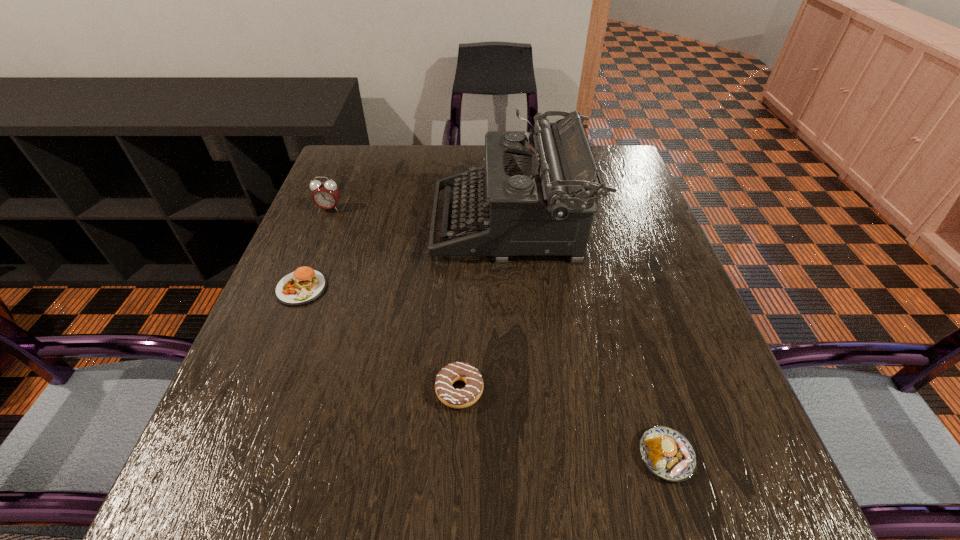
You are a GUI agent. You are given a task and a screenshot of the screen. Output one action in this format:
    pyautogui.click(x=<x>, y=<y>)
    Task: Click on the typewriter
    This screenshot has height=540, width=960.
    Given the screenshot: What is the action you would take?
    (x=539, y=193)

Identify the location of the second tallest object. Image resolution: width=960 pixels, height=540 pixels. (326, 194).

Find the location of a particular element. This screenshot has height=540, width=960. patty is located at coordinates (304, 285).

Identify the location of the second nearest object. The width and height of the screenshot is (960, 540). (455, 398).

Locate an element on the screen. the nearest object is located at coordinates (667, 453).

At what (x,y) coordinates should I click in order to perform the action: click on blank area located 0.100m on the typing side of the tallest object. Please return your answer as a coordinate pair (x, y). Looking at the image, I should click on (394, 225).

Locate an element on the screen. This screenshot has width=960, height=540. vacant space located on the typing side of the tallest object is located at coordinates [x=333, y=225].

You are a GUI agent. You are given a task and a screenshot of the screen. Output one action in this format:
    pyautogui.click(x=<x>, y=<y>)
    Task: Click on the vacant area located 0.160m on the typing side of the tallest object
    
    Given the screenshot: What is the action you would take?
    pyautogui.click(x=370, y=225)

Identify the location of free location located 0.100m on the clock face of the second tallest object. (318, 238).

Identify the location of vacant area located on the back of the third tallest object. (315, 255).